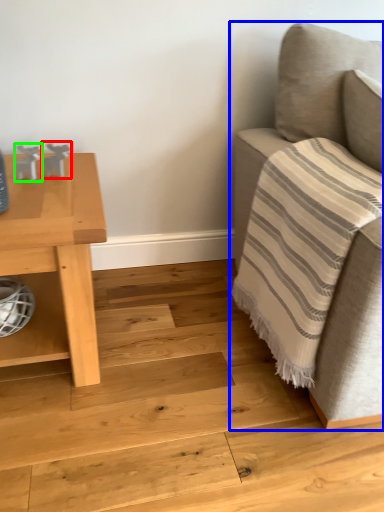
Question: Based on their relative distances, which object is nearer to toy (highlighted by a red box)? Choose from studio couch (highlighted by a blue box) and toy (highlighted by a green box).

Choices:
 (A) studio couch
 (B) toy

Answer: (B)